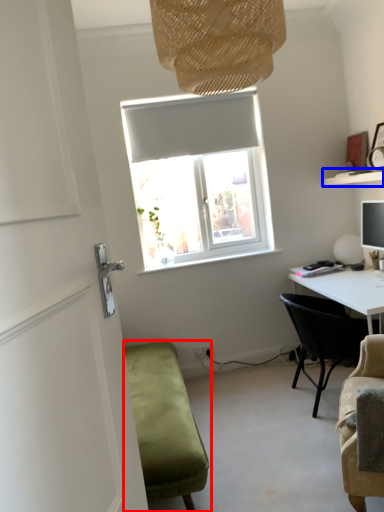
Question: Which object is further to the camera taking this photo, studio couch (highlighted by a red box) or shelf (highlighted by a blue box)?

Choices:
 (A) studio couch
 (B) shelf

Answer: (B)